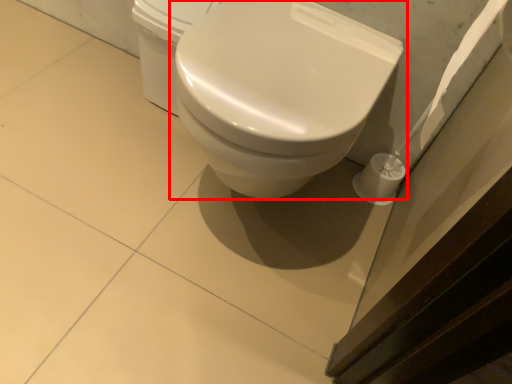
Question: In this image, where is toilet (annotated by the red box) located relative to porcelain?

Choices:
 (A) left
 (B) right

Answer: (B)